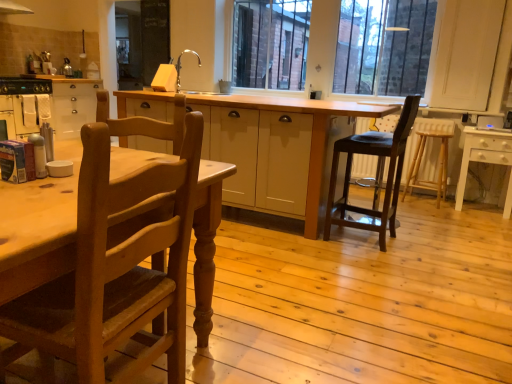
The image size is (512, 384). Identify the location of free location to the left of dark brown wood stool at center-right, placed as the 1th chair when sorted from back to front. (302, 246).